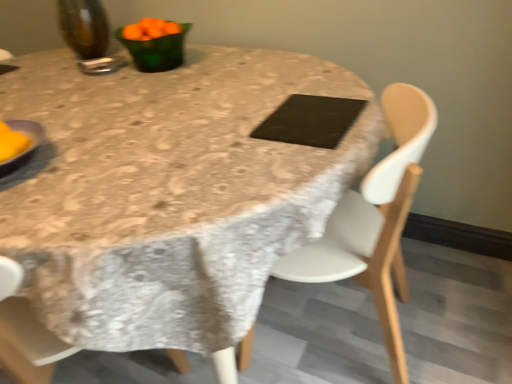
Image resolution: width=512 pixels, height=384 pixels. What do you see at coordinates (12, 142) in the screenshot?
I see `yellow matte plate at left` at bounding box center [12, 142].

What are the coordinates of `linen tablecloth at center` in the screenshot? It's located at (168, 192).

Who is bigger, yellow matte plate at left or green glass bowl at upper left, the 2th tableware when ordered from left to right?

Bigger between the two is green glass bowl at upper left, the 2th tableware when ordered from left to right.

From the image's perspective, which tableware is the 2nd one above the yellow matte plate at left? Please provide its 2D coordinates.

[(155, 43)]

Looking at this image, would you say yellow matte plate at left is a long distance from green glass bowl at upper left, the first tableware in the right-to-left sequence?

No, yellow matte plate at left is not far from green glass bowl at upper left, the first tableware in the right-to-left sequence.

Is yellow matte plate at left aimed at green glass bowl at upper left, the 2th tableware when ordered from left to right?

No, yellow matte plate at left is not facing towards green glass bowl at upper left, the 2th tableware when ordered from left to right.

Is white plastic chair at center next to green glass bowl at upper left, the first tableware in the right-to-left sequence?

white plastic chair at center is not next to green glass bowl at upper left, the first tableware in the right-to-left sequence, and they're not touching.

From the picture: Considering the sizes of objects white plastic chair at center and green glass bowl at upper left, the 2th tableware when ordered from left to right, in the image provided, who is wider, white plastic chair at center or green glass bowl at upper left, the 2th tableware when ordered from left to right,?

Wider between the two is white plastic chair at center.

Image resolution: width=512 pixels, height=384 pixels. Find the location of `tableware that is the 2nd one when counting upward from the white plastic chair at center (from the image's perspective)`. tableware that is the 2nd one when counting upward from the white plastic chair at center (from the image's perspective) is located at coordinates (155, 43).

Does point (406, 189) come in front of point (170, 33)?

That is True.

Does point (179, 44) lie behind point (81, 61)?

No, (179, 44) is in front of (81, 61).

Based on the photo, which object is thinner, green glass bowl at upper left, the first tableware in the right-to-left sequence, or metallic silver spoon at upper left, the first tableware from the left?

metallic silver spoon at upper left, the first tableware from the left, is thinner.

Between green glass bowl at upper left, the 2th tableware when ordered from left to right, and metallic silver spoon at upper left, the first tableware from the left, which one is positioned in front?

green glass bowl at upper left, the 2th tableware when ordered from left to right, is closer to the camera.

Which of these two, green glass bowl at upper left, the first tableware in the right-to-left sequence, or metallic silver spoon at upper left, the first tableware from the left, stands taller?

Standing taller between the two is green glass bowl at upper left, the first tableware in the right-to-left sequence.

Which object is further away from the camera, green glass bowl at upper left, the 2th tableware when ordered from left to right, or linen tablecloth at center?

green glass bowl at upper left, the 2th tableware when ordered from left to right, is further away from the camera.

Is green glass bowl at upper left, the first tableware in the right-to-left sequence, directly adjacent to linen tablecloth at center?

green glass bowl at upper left, the first tableware in the right-to-left sequence, is not next to linen tablecloth at center, and they're not touching.

From the image's perspective, would you say green glass bowl at upper left, the 2th tableware when ordered from left to right, is shown under linen tablecloth at center?

No, from the image's perspective, green glass bowl at upper left, the 2th tableware when ordered from left to right, is not below linen tablecloth at center.

Can you confirm if green glass bowl at upper left, the 2th tableware when ordered from left to right, is bigger than linen tablecloth at center?

Incorrect, green glass bowl at upper left, the 2th tableware when ordered from left to right, is not larger than linen tablecloth at center.

Looking at this image, between metallic silver spoon at upper left, the first tableware from the left, and white plastic chair at center, which one has larger width?

white plastic chair at center is wider.

Is metallic silver spoon at upper left, the first tableware from the left, in front of white plastic chair at center?

That is False.

Is metallic silver spoon at upper left, the second tableware in the right-to-left sequence, facing towards white plastic chair at center?

No, metallic silver spoon at upper left, the second tableware in the right-to-left sequence, is not oriented towards white plastic chair at center.

Is yellow matte plate at left oriented away from metallic silver spoon at upper left, the second tableware in the right-to-left sequence?

No, metallic silver spoon at upper left, the second tableware in the right-to-left sequence, is not at the back of yellow matte plate at left.

From the image's perspective, which object appears higher, yellow matte plate at left or metallic silver spoon at upper left, the first tableware from the left?

From the image's view, metallic silver spoon at upper left, the first tableware from the left, is above.

In the scene shown: Considering the relative sizes of yellow matte plate at left and metallic silver spoon at upper left, the first tableware from the left, in the image provided, is yellow matte plate at left smaller than metallic silver spoon at upper left, the first tableware from the left,?

Indeed, yellow matte plate at left has a smaller size compared to metallic silver spoon at upper left, the first tableware from the left.

From their relative heights in the image, would you say yellow matte plate at left is taller or shorter than metallic silver spoon at upper left, the second tableware in the right-to-left sequence?

In the image, yellow matte plate at left appears to be taller than metallic silver spoon at upper left, the second tableware in the right-to-left sequence.

Could you tell me if metallic silver spoon at upper left, the first tableware from the left, is facing yellow matte plate at left?

Yes, metallic silver spoon at upper left, the first tableware from the left, is aimed at yellow matte plate at left.

Considering the relative sizes of metallic silver spoon at upper left, the second tableware in the right-to-left sequence, and yellow matte plate at left in the image provided, is metallic silver spoon at upper left, the second tableware in the right-to-left sequence, bigger than yellow matte plate at left?

Yes, metallic silver spoon at upper left, the second tableware in the right-to-left sequence, is bigger than yellow matte plate at left.

Is metallic silver spoon at upper left, the second tableware in the right-to-left sequence, taller or shorter than yellow matte plate at left?

Considering their sizes, metallic silver spoon at upper left, the second tableware in the right-to-left sequence, has less height than yellow matte plate at left.

Is metallic silver spoon at upper left, the first tableware from the left, wider than yellow matte plate at left?

Indeed, metallic silver spoon at upper left, the first tableware from the left, has a greater width compared to yellow matte plate at left.

This screenshot has width=512, height=384. I want to click on tableware that is the 2nd one when counting upward from the yellow matte plate at left (from the image's perspective), so click(155, 43).

In the image, there is a green glass bowl at upper left, the first tableware in the right-to-left sequence. Where is `chair below it (from a real-world perspective)`? This screenshot has width=512, height=384. chair below it (from a real-world perspective) is located at coordinates (374, 221).

Which object lies nearer to the anchor point white plastic chair at center, black matte pad at center or green glass bowl at upper left, the first tableware in the right-to-left sequence?

Based on the image, black matte pad at center appears to be nearer to white plastic chair at center.

From the image, which object appears to be nearer to black matte pad at center, linen tablecloth at center or metallic silver spoon at upper left, the second tableware in the right-to-left sequence?

linen tablecloth at center lies closer to black matte pad at center than the other object.

Looking at the image, which one is located closer to linen tablecloth at center, white plastic chair at center or yellow matte plate at left?

The object closer to linen tablecloth at center is white plastic chair at center.

Looking at the image, which one is located further to white plastic chair at center, linen tablecloth at center or black matte pad at center?

black matte pad at center is further to white plastic chair at center.

Which object lies further to the anchor point yellow matte plate at left, white plastic chair at center or green glass bowl at upper left, the first tableware in the right-to-left sequence?

Among the two, white plastic chair at center is located further to yellow matte plate at left.

When comparing their distances from white plastic chair at center, does yellow matte plate at left or green glass bowl at upper left, the first tableware in the right-to-left sequence, seem closer?

green glass bowl at upper left, the first tableware in the right-to-left sequence, is closer to white plastic chair at center.

Looking at the image, which one is located further to yellow matte plate at left, black matte pad at center or linen tablecloth at center?

black matte pad at center is positioned further to the anchor yellow matte plate at left.

When comparing their distances from yellow matte plate at left, does white plastic chair at center or linen tablecloth at center seem further?

white plastic chair at center lies further to yellow matte plate at left than the other object.

Identify the location of tableware between metallic silver spoon at upper left, the first tableware from the left, and black matte pad at center from left to right. The width and height of the screenshot is (512, 384). (155, 43).

Where is `food situated between metallic silver spoon at upper left, the first tableware from the left, and black matte pad at center from left to right`? The width and height of the screenshot is (512, 384). food situated between metallic silver spoon at upper left, the first tableware from the left, and black matte pad at center from left to right is located at coordinates (12, 142).

Find the location of a particular element. The width and height of the screenshot is (512, 384). pad between linen tablecloth at center and green glass bowl at upper left, the 2th tableware when ordered from left to right, in the front-back direction is located at coordinates (310, 121).

The image size is (512, 384). Identify the location of chair located between linen tablecloth at center and green glass bowl at upper left, the first tableware in the right-to-left sequence, in the depth direction. click(374, 221).